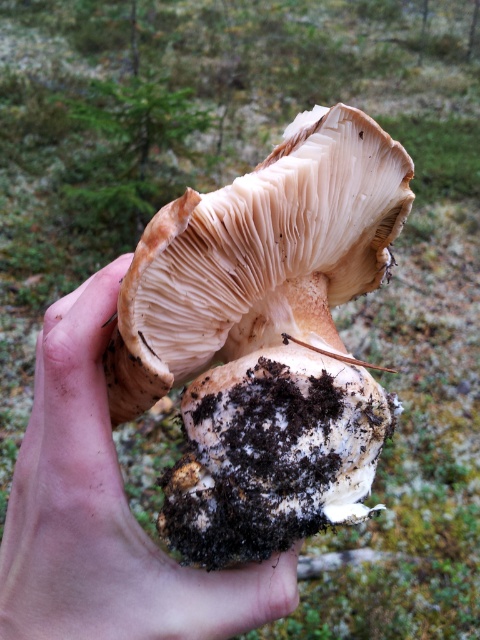
Question: Does brown fibrous mushroom at center have a greater width compared to smooth beige mushroom at center?

Choices:
 (A) no
 (B) yes

Answer: (B)

Question: Which point is farther to the camera?

Choices:
 (A) (11, 580)
 (B) (128, 362)

Answer: (B)

Question: Is brown fibrous mushroom at center positioned before smooth beige mushroom at center?

Choices:
 (A) no
 (B) yes

Answer: (B)

Question: Does brown fibrous mushroom at center appear on the left side of smooth beige mushroom at center?

Choices:
 (A) yes
 (B) no

Answer: (B)

Question: Which point is closer to the camera taking this photo?

Choices:
 (A) (350, 218)
 (B) (98, 358)

Answer: (B)

Question: Which of the following is the closest to the observer?

Choices:
 (A) smooth beige mushroom at center
 (B) brown fibrous mushroom at center

Answer: (B)